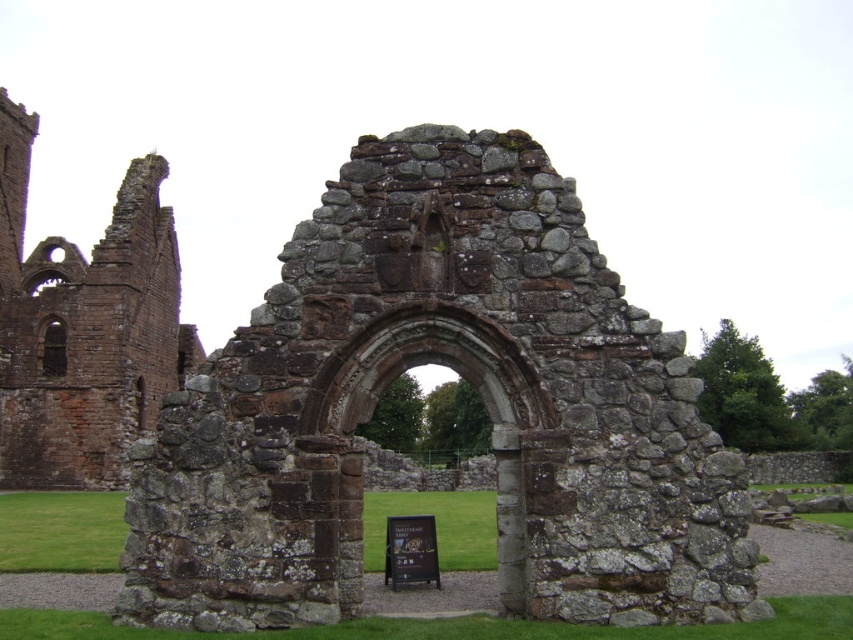
You are an archaeologist examining the ancient ruins. You notice the brown stone arch at center and the wooden signboard at center. Which object is positioned higher in the scene?

The brown stone arch at center is above the wooden signboard at center, so it is positioned higher.

You are an archaeologist exploring the ruins. You see a brown stone arch at center and a wooden signboard at center. Which object is positioned to the right of the other?

The brown stone arch at center is to the right of the wooden signboard at center.